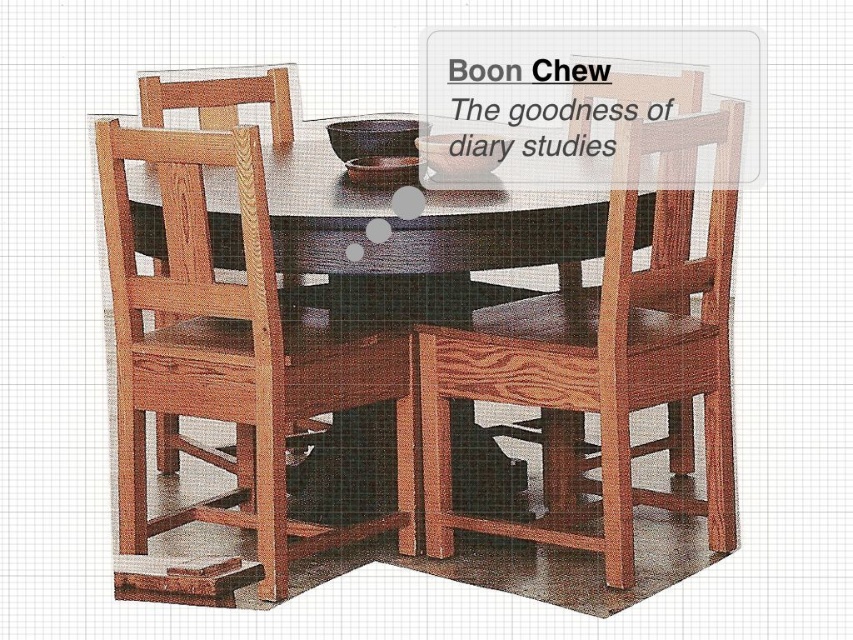
Consider the image. Between wooden chair at center and natural wood chair at lower left, which one has more height?

wooden chair at center is taller.

Is wooden chair at center taller than natural wood chair at lower left?

Yes, wooden chair at center is taller than natural wood chair at lower left.

Measure the distance between wooden chair at center and camera.

wooden chair at center is 6.98 feet from camera.

The height and width of the screenshot is (640, 853). What are the coordinates of `wooden chair at center` in the screenshot? It's located at (606, 356).

Is natural wood chair at lower left taller than natural wood chair at center?

Yes.

Is natural wood chair at lower left to the right of natural wood chair at center from the viewer's perspective?

Yes, natural wood chair at lower left is to the right of natural wood chair at center.

What are the coordinates of `natural wood chair at lower left` in the screenshot? It's located at (234, 356).

The width and height of the screenshot is (853, 640). I want to click on natural wood chair at lower left, so click(234, 356).

Is wooden table at center smaller than natural wood chair at center?

No.

Does wooden table at center have a lesser height compared to natural wood chair at center?

In fact, wooden table at center may be taller than natural wood chair at center.

The image size is (853, 640). What do you see at coordinates (234, 353) in the screenshot?
I see `wooden table at center` at bounding box center [234, 353].

At what (x,y) coordinates should I click in order to perform the action: click on wooden table at center. Please return your answer as a coordinate pair (x, y). Looking at the image, I should click on (234, 353).